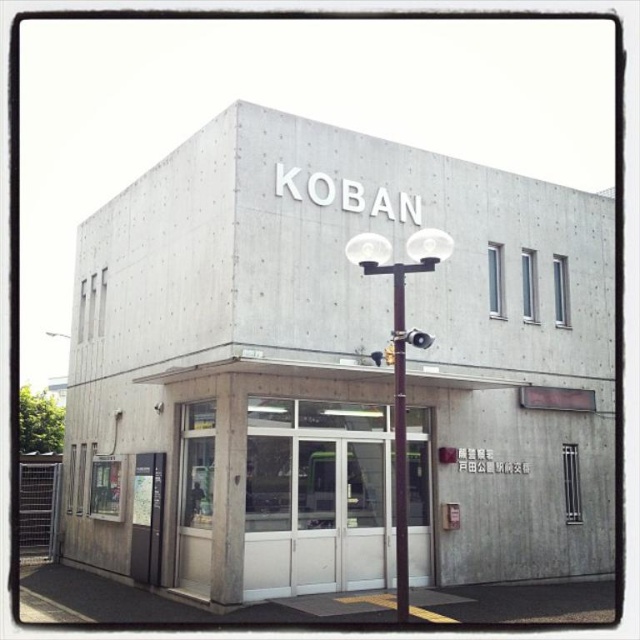
Question: Which object is farther from the camera taking this photo?

Choices:
 (A) white concrete pole at center
 (B) smooth concrete sign at lower left

Answer: (B)

Question: Is the position of brown polished metal streetlight at center less distant than that of smooth concrete sign at lower left?

Choices:
 (A) yes
 (B) no

Answer: (A)

Question: Among these objects, which one is farthest from the camera?

Choices:
 (A) smooth concrete sign at lower left
 (B) white concrete pole at center

Answer: (A)

Question: Is brown polished metal streetlight at center bigger than smooth concrete sign at lower left?

Choices:
 (A) no
 (B) yes

Answer: (A)

Question: Estimate the real-world distances between objects in this image. Which object is closer to the smooth concrete sign at lower left?

Choices:
 (A) white concrete pole at center
 (B) brown polished metal streetlight at center
 (C) concrete building at center

Answer: (C)

Question: Can you confirm if concrete building at center is positioned below white concrete pole at center?

Choices:
 (A) no
 (B) yes

Answer: (A)